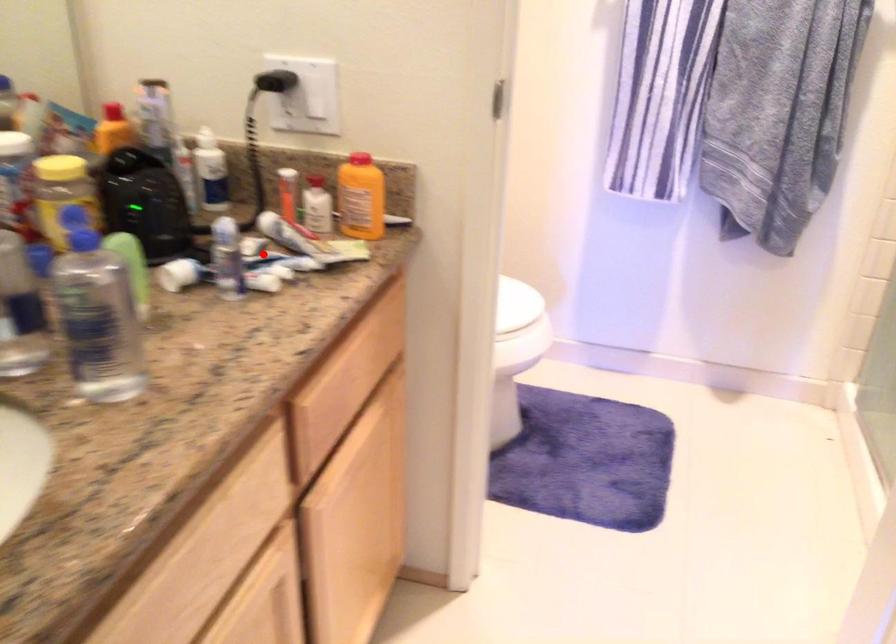
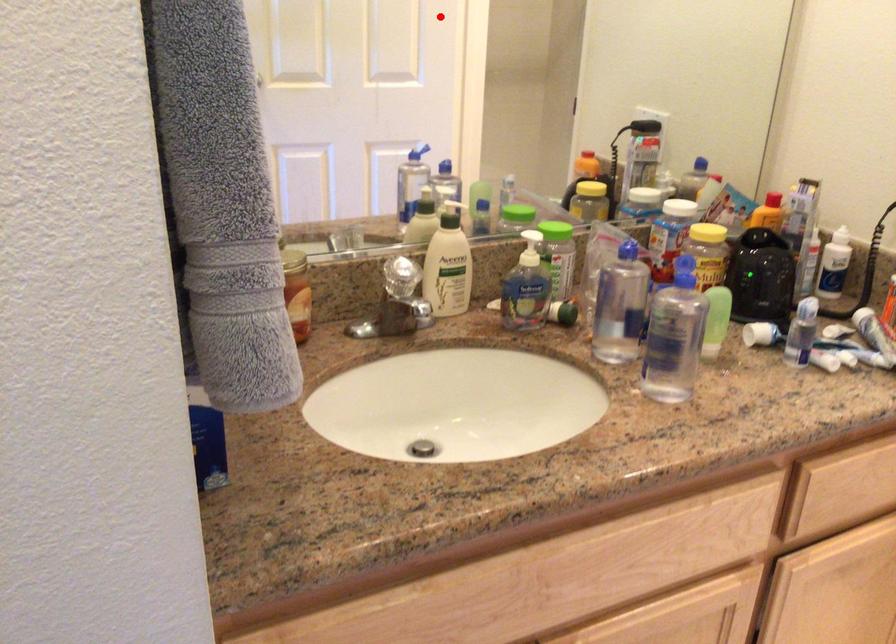
I am providing you with two images of the same scene from different viewpoints. A red point is marked on the first image and another point is marked on the second image. Is the red point in image1 aligned with the point shown in image2?

No